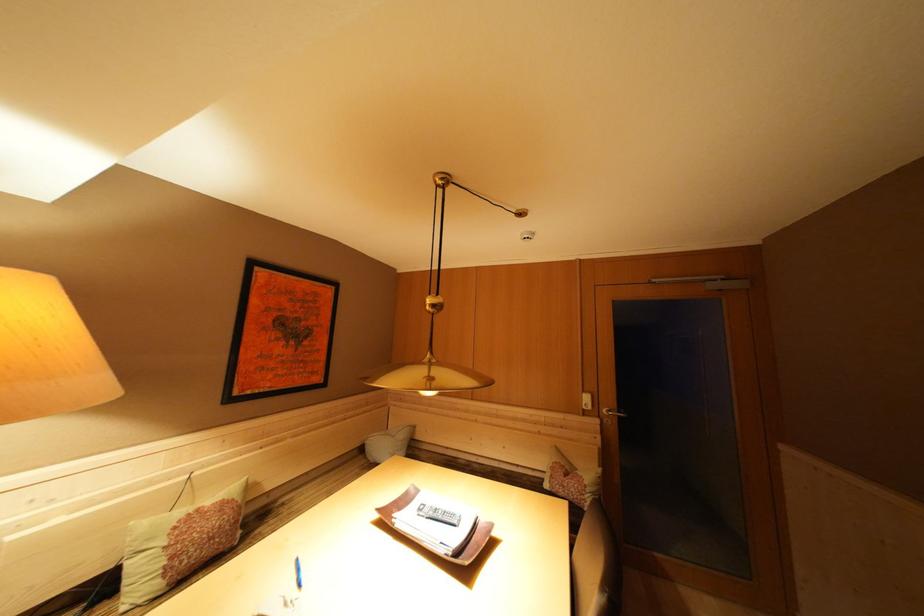
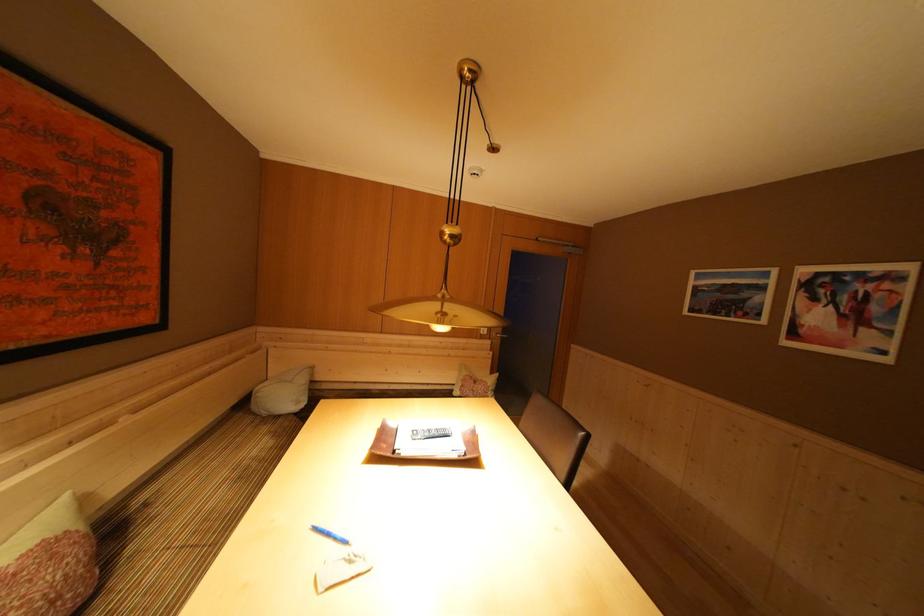
Question: The images are taken continuously from a first-person perspective. In which direction is your viewpoint rotating?

Choices:
 (A) Left
 (B) Right
 (C) Up
 (D) Down

Answer: (B)